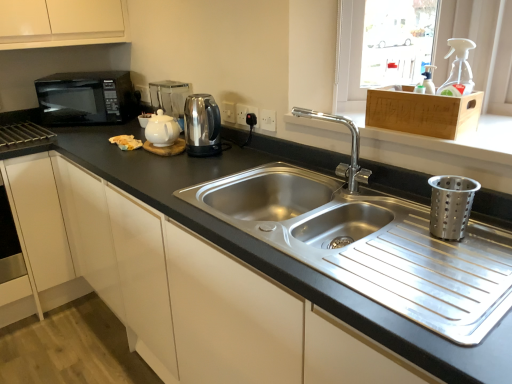
This screenshot has height=384, width=512. In order to click on vacant space to the right of stainless steel kettle at center in this screenshot , I will do `click(243, 160)`.